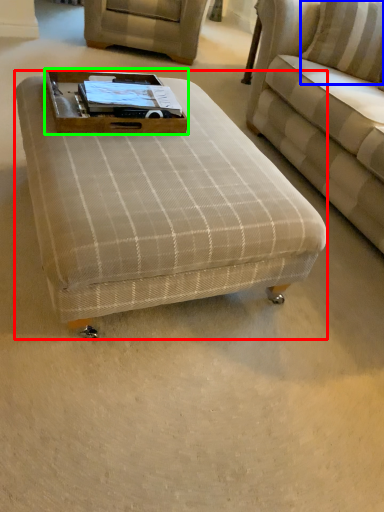
Question: Based on their relative distances, which object is nearer to table (highlighted by a red box)? Choose from pillow (highlighted by a blue box) and side table (highlighted by a green box).

Choices:
 (A) pillow
 (B) side table

Answer: (B)